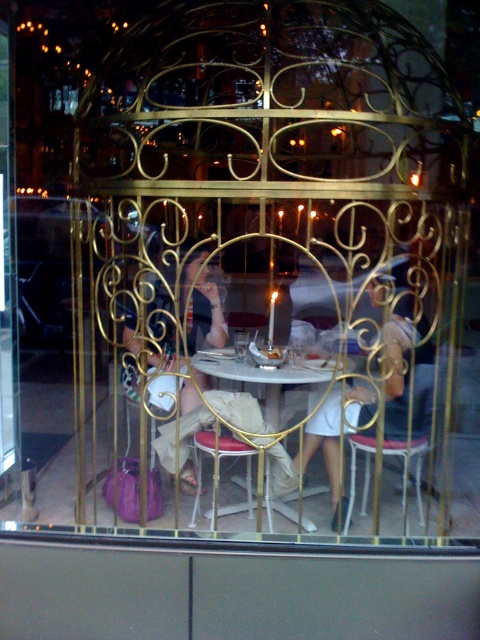
Is white matte dress at center in front of matte black dress at center?

That is True.

Who is more distant from viewer, (398, 392) or (168, 260)?

Positioned behind is point (398, 392).

Does point (326, 461) lie in front of point (140, 356)?

No, (326, 461) is further to viewer.

Where is `white matte dress at center`? white matte dress at center is located at coordinates (398, 364).

Is matte black dress at center closer to the viewer compared to smooth leather chair at center?

Yes, it is.

Which is behind, point (188, 301) or point (365, 406)?

Point (188, 301)

Does point (192, 282) come in front of point (432, 369)?

No, (192, 282) is further to viewer.

This screenshot has height=640, width=480. Identify the location of matte black dress at center. (186, 316).

Does white matte dress at center appear over white glossy table at center?

Indeed, white matte dress at center is positioned over white glossy table at center.

Does point (382, 369) come behind point (220, 352)?

No, (382, 369) is closer to viewer.

Image resolution: width=480 pixels, height=640 pixels. I want to click on white matte dress at center, so click(x=398, y=364).